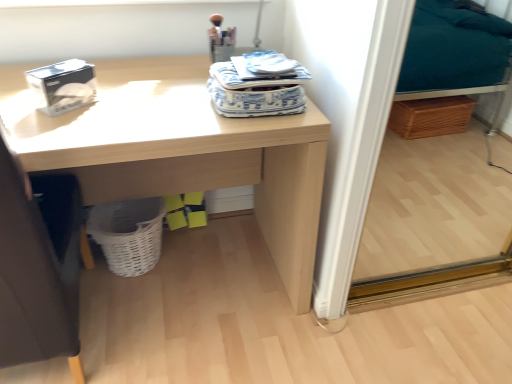
What do you see at coordinates (181, 151) in the screenshot? This screenshot has height=384, width=512. I see `light wood desk at center` at bounding box center [181, 151].

Where is `white woven basket at lower left`? The image size is (512, 384). white woven basket at lower left is located at coordinates (x=128, y=234).

This screenshot has width=512, height=384. Describe the element at coordinates (38, 264) in the screenshot. I see `dark gray fabric swivel chair at left` at that location.

Where is `white matte tissue box at upper left, positioned as the second box in right-to-left order`? Image resolution: width=512 pixels, height=384 pixels. white matte tissue box at upper left, positioned as the second box in right-to-left order is located at coordinates (63, 86).

Find the location of `light wood desk at center`. light wood desk at center is located at coordinates (181, 151).

Is dark gray fabric swivel chair at left looking in the opposite direction of white matte tissue box at upper left, which appears as the first box when viewed from the top?

dark gray fabric swivel chair at left is not turned away from white matte tissue box at upper left, which appears as the first box when viewed from the top.

Is dark gray fabric swivel chair at left bigger or smaller than white matte tissue box at upper left, which appears as the first box when viewed from the top?

dark gray fabric swivel chair at left is bigger than white matte tissue box at upper left, which appears as the first box when viewed from the top.

Does point (49, 237) lie behind point (58, 67)?

That is False.

Considering the positions of objects white woven basket at lower left and white matte tissue box at upper left, which ranks as the first box in left-to-right order, in the image provided, who is more to the left, white woven basket at lower left or white matte tissue box at upper left, which ranks as the first box in left-to-right order,?

A: white matte tissue box at upper left, which ranks as the first box in left-to-right order.

Which of these two, white woven basket at lower left or white matte tissue box at upper left, positioned as the second box in right-to-left order, is wider?

white woven basket at lower left.

Between white woven basket at lower left and white matte tissue box at upper left, which ranks as the first box in left-to-right order, which one has larger size?

white woven basket at lower left.

Which object is closer to the camera taking this photo, white woven basket at lower left or white matte tissue box at upper left, marked as the second box in a back-to-front arrangement?

white matte tissue box at upper left, marked as the second box in a back-to-front arrangement, is in front.

From the image's perspective, would you say dark gray fabric swivel chair at left is positioned over yellow matte box at lower center, the second box when ordered from left to right?

Correct, dark gray fabric swivel chair at left appears higher than yellow matte box at lower center, the second box when ordered from left to right, in the image.

Could you tell me if dark gray fabric swivel chair at left is facing yellow matte box at lower center, marked as the second box in a top-to-bottom arrangement?

No, dark gray fabric swivel chair at left is not aimed at yellow matte box at lower center, marked as the second box in a top-to-bottom arrangement.

Between dark gray fabric swivel chair at left and yellow matte box at lower center, which appears as the second box when viewed from the front, which one has larger width?

dark gray fabric swivel chair at left is wider.

Based on the photo, which object is further away from the camera taking this photo, yellow matte box at lower center, marked as the second box in a top-to-bottom arrangement, or dark gray fabric swivel chair at left?

yellow matte box at lower center, marked as the second box in a top-to-bottom arrangement.

Consider the image. From the image's perspective, is yellow matte box at lower center, marked as the second box in a top-to-bottom arrangement, above or below dark gray fabric swivel chair at left?

yellow matte box at lower center, marked as the second box in a top-to-bottom arrangement, is situated lower than dark gray fabric swivel chair at left in the image.

The height and width of the screenshot is (384, 512). Identify the location of swivel chair located on the left of yellow matte box at lower center, marked as the second box in a top-to-bottom arrangement. (38, 264).

Is white matte tissue box at upper left, which ranks as the first box in left-to-right order, aimed at white woven basket at lower left?

No, white matte tissue box at upper left, which ranks as the first box in left-to-right order, is not aimed at white woven basket at lower left.

Is there a large distance between white matte tissue box at upper left, marked as the 2th box in a bottom-to-top arrangement, and white woven basket at lower left?

white matte tissue box at upper left, marked as the 2th box in a bottom-to-top arrangement, is near white woven basket at lower left, not far away.

Considering the positions of point (39, 79) and point (102, 245), is point (39, 79) closer or farther from the camera than point (102, 245)?

Point (39, 79) appears to be closer to the viewer than point (102, 245).

Could you measure the distance between white matte tissue box at upper left, the 1th box when ordered from front to back, and white woven basket at lower left?

white matte tissue box at upper left, the 1th box when ordered from front to back, is 61.66 centimeters from white woven basket at lower left.

Which object is further away from the camera taking this photo, white matte tissue box at upper left, positioned as the second box in right-to-left order, or light wood desk at center?

white matte tissue box at upper left, positioned as the second box in right-to-left order, is further away from the camera.

In the image, is white matte tissue box at upper left, the 1th box when ordered from front to back, on the left side or the right side of light wood desk at center?

In the image, white matte tissue box at upper left, the 1th box when ordered from front to back, appears on the left side of light wood desk at center.

Is light wood desk at center completely or partially inside white matte tissue box at upper left, marked as the 2th box in a bottom-to-top arrangement?

Definitely not — light wood desk at center is not inside white matte tissue box at upper left, marked as the 2th box in a bottom-to-top arrangement.

What's the angular difference between white matte tissue box at upper left, which ranks as the first box in left-to-right order, and light wood desk at center's facing directions?

30.1 degrees.

This screenshot has height=384, width=512. I want to click on swivel chair that is above the light wood desk at center (from a real-world perspective), so click(38, 264).

Is light wood desk at center directly adjacent to dark gray fabric swivel chair at left?

No, light wood desk at center is not next to dark gray fabric swivel chair at left.

Is light wood desk at center positioned in front of dark gray fabric swivel chair at left?

No, light wood desk at center is behind dark gray fabric swivel chair at left.

Considering the points (245, 126) and (66, 287), which point is behind, point (245, 126) or point (66, 287)?

The point (66, 287) is farther from the camera.

Where is `swivel chair on the left of white matte tissue box at upper left, positioned as the second box in right-to-left order`? This screenshot has height=384, width=512. swivel chair on the left of white matte tissue box at upper left, positioned as the second box in right-to-left order is located at coordinates (38, 264).

The height and width of the screenshot is (384, 512). I want to click on box that is the 2nd object located above the white woven basket at lower left (from the image's perspective), so click(x=63, y=86).

From the image, which object appears to be nearer to dark gray fabric swivel chair at left, yellow matte box at lower center, which is the 1th box in back-to-front order, or white woven basket at lower left?

white woven basket at lower left.

Estimate the real-world distances between objects in this image. Which object is further from light wood desk at center, dark gray fabric swivel chair at left or white woven basket at lower left?

The object further to light wood desk at center is dark gray fabric swivel chair at left.

Based on the photo, considering their positions, is yellow matte box at lower center, which is the 1th box in right-to-left order, positioned closer to light wood desk at center than dark gray fabric swivel chair at left?

dark gray fabric swivel chair at left lies closer to light wood desk at center than the other object.

From the image, which object appears to be farther from light wood desk at center, dark gray fabric swivel chair at left or yellow matte box at lower center, which is the 1th box in right-to-left order?

yellow matte box at lower center, which is the 1th box in right-to-left order, is further to light wood desk at center.

Which object lies nearer to the anchor point white matte tissue box at upper left, the 1th box when ordered from front to back, yellow matte box at lower center, the first box in the bottom-to-top sequence, or dark gray fabric swivel chair at left?

dark gray fabric swivel chair at left.

Estimate the real-world distances between objects in this image. Which object is closer to white woven basket at lower left, dark gray fabric swivel chair at left or yellow matte box at lower center, the first box in the bottom-to-top sequence?

yellow matte box at lower center, the first box in the bottom-to-top sequence, is closer to white woven basket at lower left.

From the image, which object appears to be nearer to dark gray fabric swivel chair at left, white woven basket at lower left or yellow matte box at lower center, which is the 1th box in right-to-left order?

Among the two, white woven basket at lower left is located nearer to dark gray fabric swivel chair at left.

Estimate the real-world distances between objects in this image. Which object is closer to white woven basket at lower left, white matte tissue box at upper left, marked as the second box in a back-to-front arrangement, or dark gray fabric swivel chair at left?

dark gray fabric swivel chair at left is positioned closer to the anchor white woven basket at lower left.

The image size is (512, 384). What are the coordinates of `basket positioned between light wood desk at center and yellow matte box at lower center, the first box in the bottom-to-top sequence, from near to far` in the screenshot? It's located at (128, 234).

Where is `box located between light wood desk at center and yellow matte box at lower center, which appears as the second box when viewed from the front, in the depth direction`? This screenshot has height=384, width=512. box located between light wood desk at center and yellow matte box at lower center, which appears as the second box when viewed from the front, in the depth direction is located at coordinates (63, 86).

I want to click on basket between white matte tissue box at upper left, marked as the 2th box in a bottom-to-top arrangement, and yellow matte box at lower center, which appears as the second box when viewed from the front, in the front-back direction, so click(128, 234).

Locate an element on the screen. desk between dark gray fabric swivel chair at left and yellow matte box at lower center, which appears as the second box when viewed from the front, from front to back is located at coordinates (181, 151).